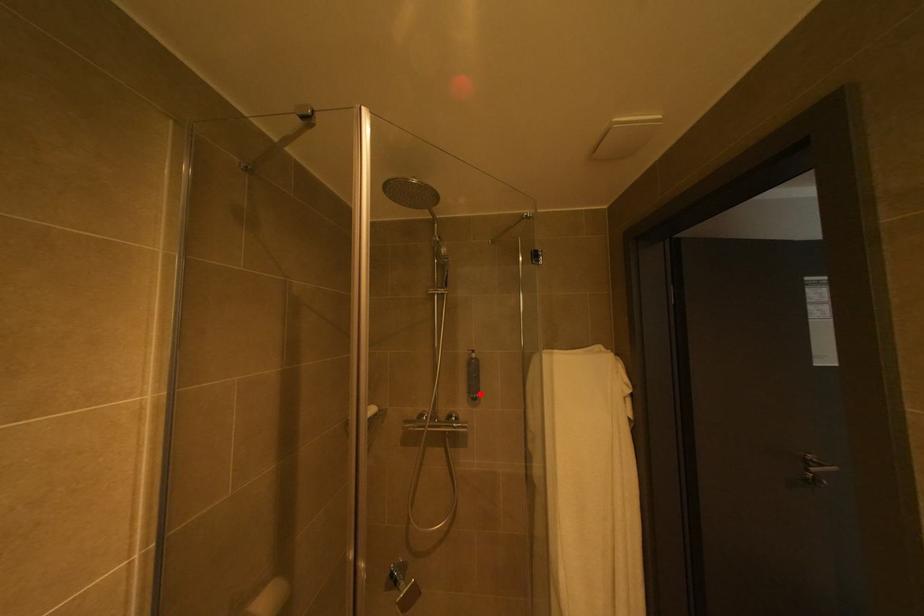
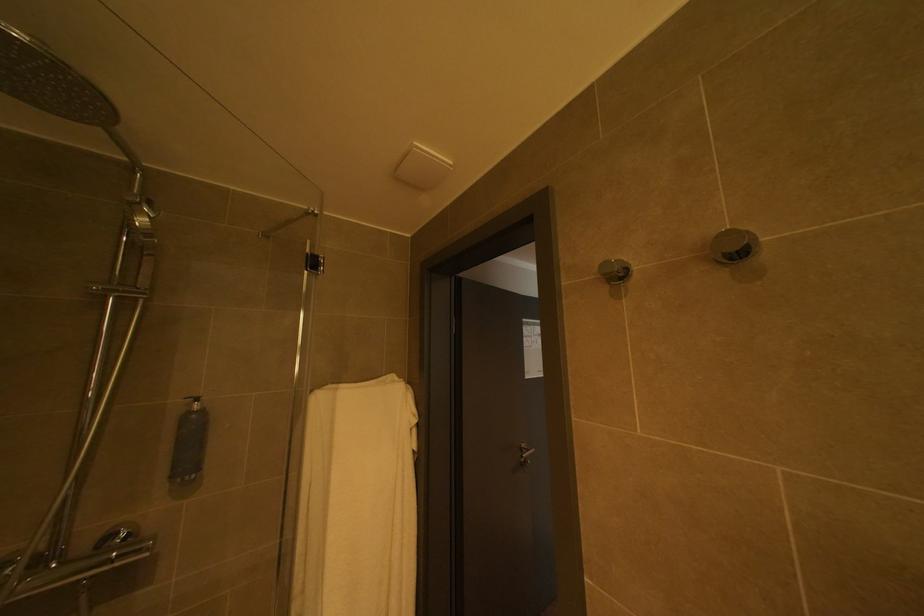
Question: A red point is marked in image1. In image2, is the corresponding 3D point closer to the camera or farther? Reply with the corresponding letter.

Choices:
 (A) The corresponding 3D point is closer.
 (B) The corresponding 3D point is farther.

Answer: (A)